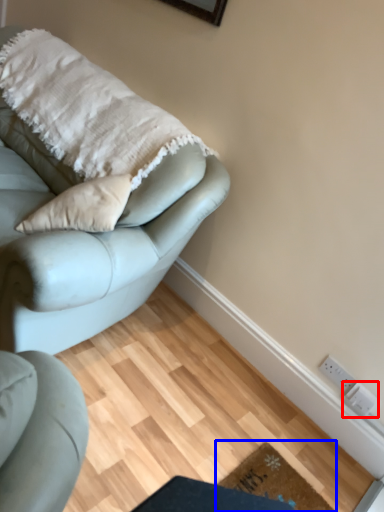
Question: Among these objects, which one is nearest to the camera, electric outlet (highlighted by a red box) or doormat (highlighted by a blue box)?

Choices:
 (A) electric outlet
 (B) doormat

Answer: (B)